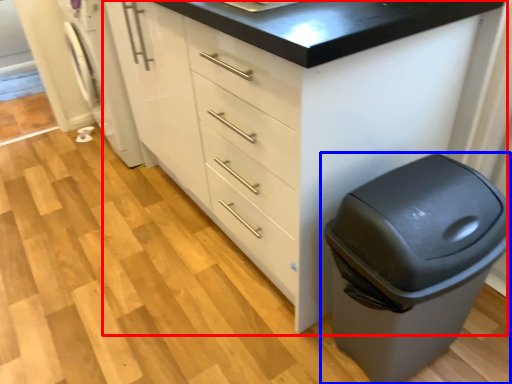
Question: Which of the following is the farthest to the observer, chest of drawers (highlighted by a red box) or waste container (highlighted by a blue box)?

Choices:
 (A) chest of drawers
 (B) waste container

Answer: (B)